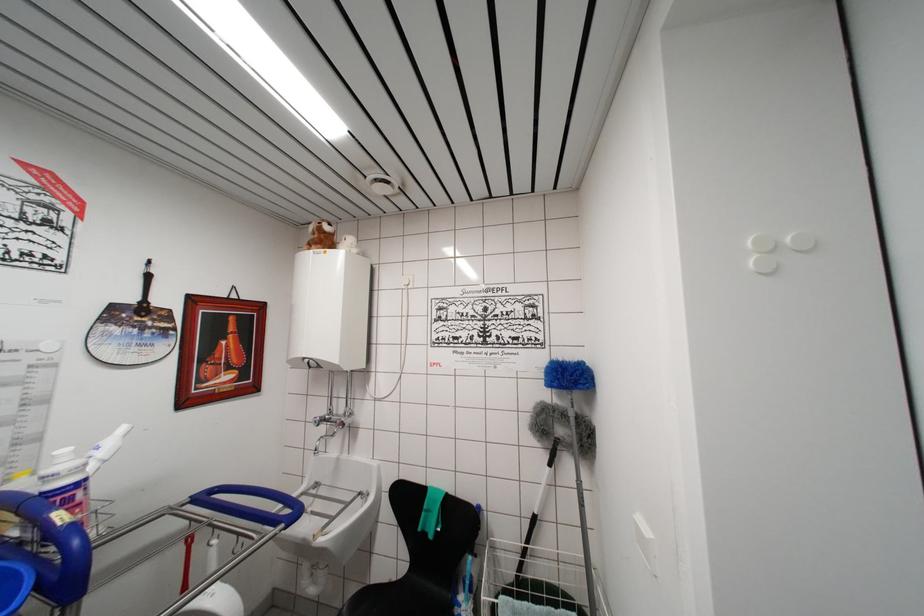
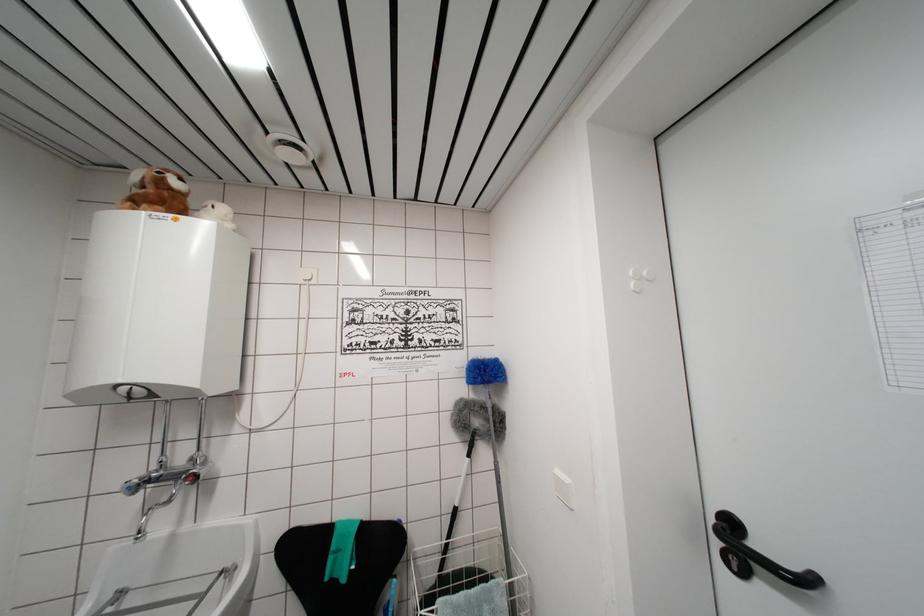
The point at (563, 374) is marked in the first image. Where is the corresponding point in the second image?

(484, 371)